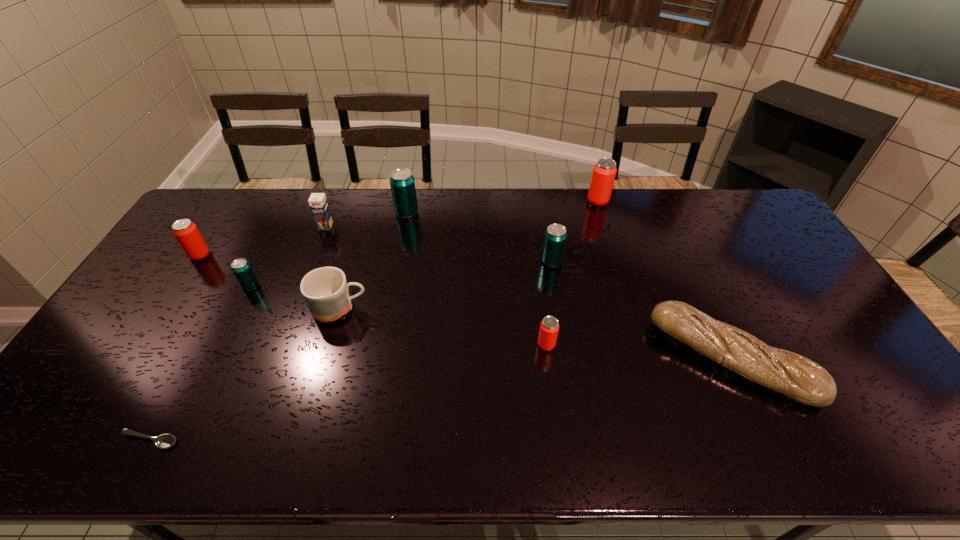
The height and width of the screenshot is (540, 960). What are the coordinates of `free space between the nearest beer can and the leftmost object` in the screenshot? It's located at 373,300.

You are a GUI agent. You are given a task and a screenshot of the screen. Output one action in this format:
    pyautogui.click(x=<x>, y=<y>)
    Task: Click on the free space between the shortest object and the sixth farthest object
    
    Given the screenshot: What is the action you would take?
    pyautogui.click(x=201, y=363)

You are a GUI agent. You are given a task and a screenshot of the screen. Output one action in this format:
    pyautogui.click(x=<x>, y=<y>)
    Task: Click on the vacant space in between the second beer can from left to right and the second farthest teal beer can
    The width and height of the screenshot is (960, 540).
    Given the screenshot: What is the action you would take?
    pyautogui.click(x=401, y=274)

Where is `free space between the fifth object from left to right and the soupspoon`? Image resolution: width=960 pixels, height=540 pixels. free space between the fifth object from left to right and the soupspoon is located at coordinates (245, 375).

Identify the location of vacant region between the eighth nearest object and the rightmost red beer can. Image resolution: width=960 pixels, height=540 pixels. (462, 214).

This screenshot has height=540, width=960. What are the coordinates of `vacant space in between the shortest object and the nearest teal beer can` in the screenshot? It's located at (201, 363).

In order to click on the sixth closest object to the fourth object from left to right in this screenshot , I will do `click(164, 441)`.

Select which object is the third closest to the baguet. Please provide its 2D coordinates. Your answer should be formatted as a tuple, i.e. [(x, y)], where the tuple contains the x and y coordinates of a point satisfying the conditions above.

[(604, 171)]

Identify the location of the second closest beer can to the farthest red beer can. The height and width of the screenshot is (540, 960). (549, 327).

Where is `the second closest beer can to the rightmost teal beer can`? This screenshot has height=540, width=960. the second closest beer can to the rightmost teal beer can is located at coordinates point(604,171).